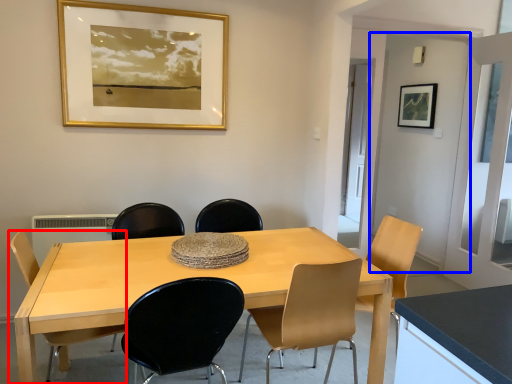
Question: Which object is closer to the camera taking this photo, chair (highlighted by a red box) or door (highlighted by a blue box)?

Choices:
 (A) chair
 (B) door

Answer: (A)